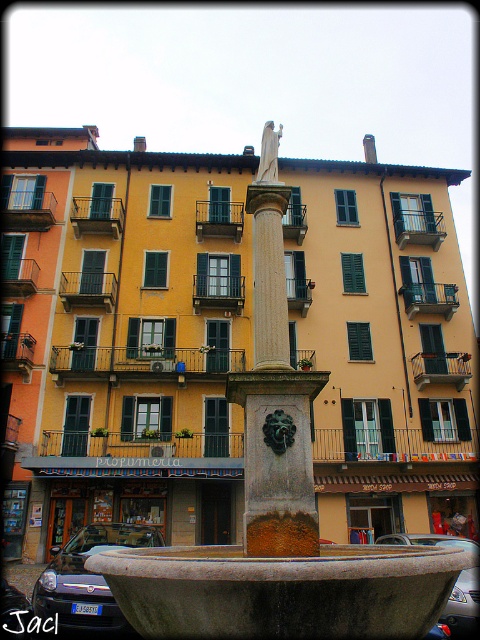
Question: Which point appears farthest from the camera in this image?

Choices:
 (A) (261, 157)
 (B) (280, 346)

Answer: (A)

Question: Is stone fountain at center above white marble statue at center?

Choices:
 (A) no
 (B) yes

Answer: (A)

Question: Can you confirm if stone fountain at center is positioned to the left of white marble statue at center?

Choices:
 (A) yes
 (B) no

Answer: (B)

Question: Which object is farther from the camera taking this photo?

Choices:
 (A) stone fountain at center
 (B) white marble statue at center

Answer: (B)

Question: Can you confirm if stone fountain at center is positioned to the left of white marble statue at center?

Choices:
 (A) yes
 (B) no

Answer: (B)